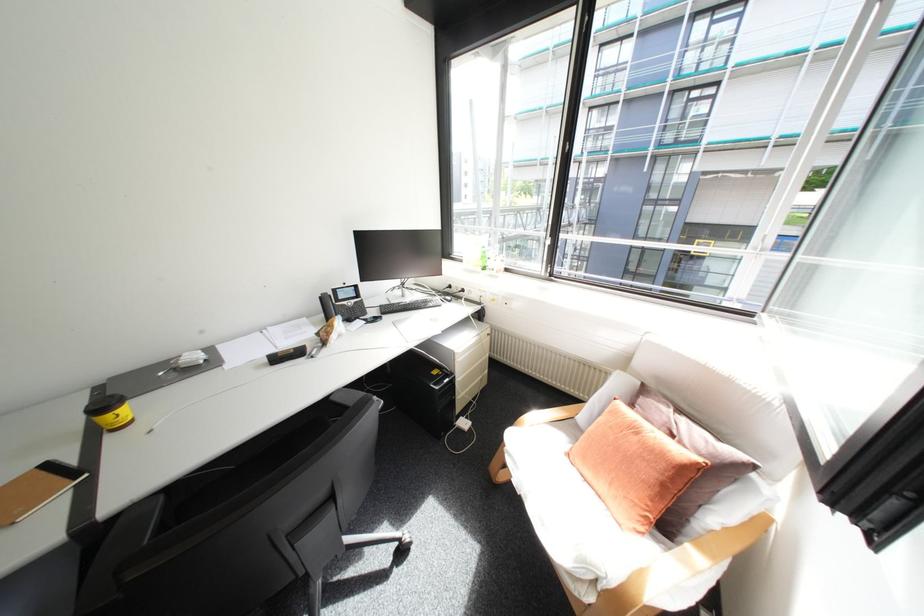
Describe the element at coordinates (326, 306) in the screenshot. I see `the telephone handset` at that location.